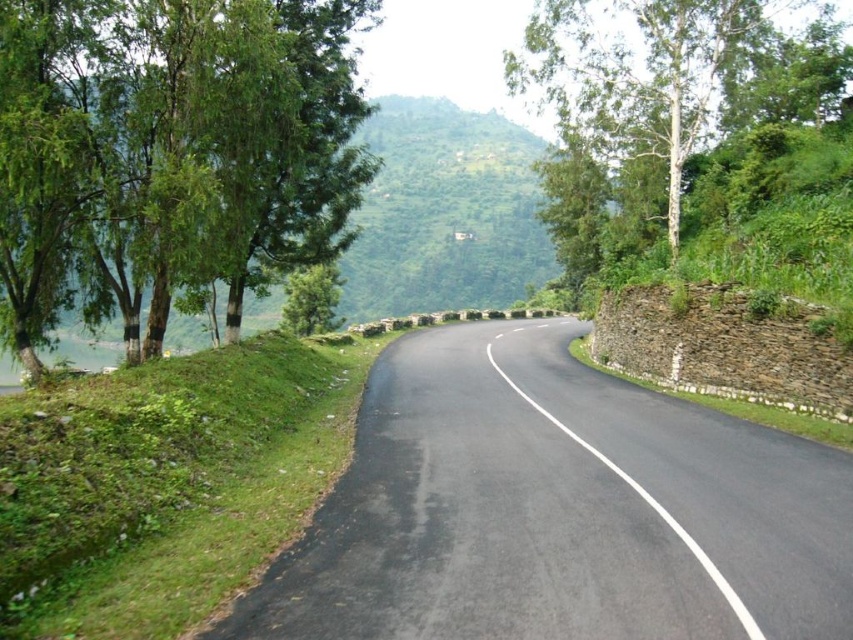
The height and width of the screenshot is (640, 853). What do you see at coordinates (556, 509) in the screenshot?
I see `black asphalt road at center` at bounding box center [556, 509].

Which is more to the right, black asphalt road at center or white smooth tree at upper center?

white smooth tree at upper center

Is point (352, 580) closer to viewer compared to point (583, 276)?

Yes, it is in front of point (583, 276).

I want to click on black asphalt road at center, so click(556, 509).

Can you confirm if green leafy tree at left is positioned to the left of white smooth tree at upper center?

Indeed, green leafy tree at left is positioned on the left side of white smooth tree at upper center.

Can you confirm if green leafy tree at left is wider than white smooth tree at upper center?

Incorrect, green leafy tree at left's width does not surpass white smooth tree at upper center's.

Who is more forward, (0, 320) or (695, 129)?

Point (0, 320) is more forward.

Find the location of a particular element. green leafy tree at left is located at coordinates (170, 154).

How distant is black asphalt road at center from green leafy tree at left?

black asphalt road at center is 21.31 feet away from green leafy tree at left.

Is black asphalt road at center taller than green leafy tree at left?

No, black asphalt road at center is not taller than green leafy tree at left.

You are a GUI agent. You are given a task and a screenshot of the screen. Output one action in this format:
    pyautogui.click(x=<x>, y=<y>)
    Task: Click on the black asphalt road at center
    
    Given the screenshot: What is the action you would take?
    pyautogui.click(x=556, y=509)